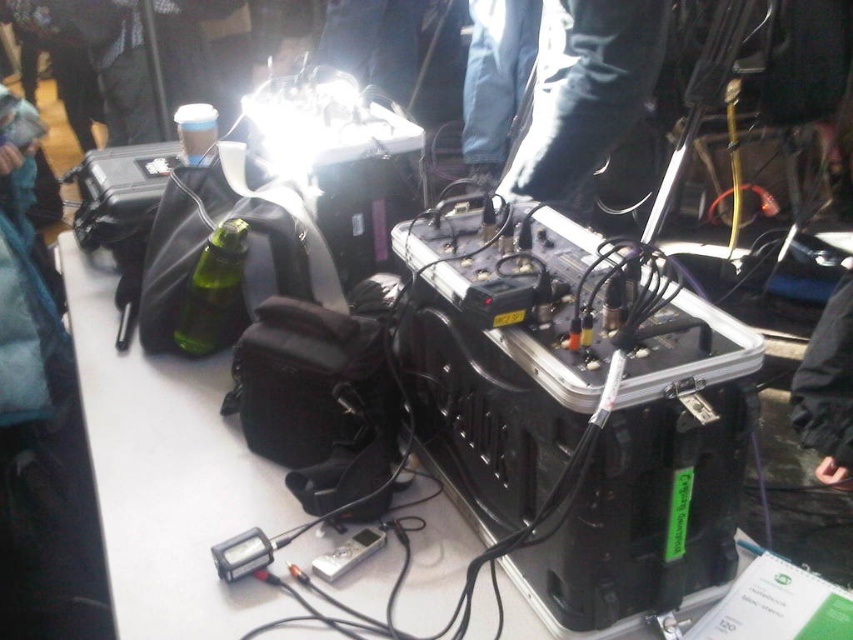
Based on the photo, is black leather boots at upper center wider than black fabric jacket at lower right?

Yes.

Which is in front, point (531, 172) or point (819, 356)?

Point (531, 172)

Image resolution: width=853 pixels, height=640 pixels. I want to click on black leather boots at upper center, so click(x=585, y=90).